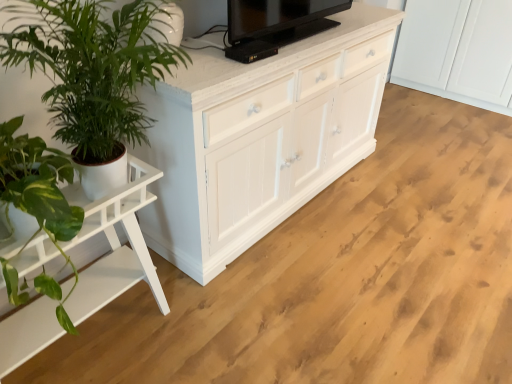
What is the approximate height of green leafy plant at left?

The height of green leafy plant at left is 25.84 inches.

The height and width of the screenshot is (384, 512). Identify the location of white wood table at left. (114, 244).

Where is `green leafy plant at left`? green leafy plant at left is located at coordinates (92, 76).

Does white wood table at left have a larger size compared to black glossy tv at upper center?

Correct, white wood table at left is larger in size than black glossy tv at upper center.

Considering the relative positions of white wood table at left and black glossy tv at upper center in the image provided, is white wood table at left in front of black glossy tv at upper center?

Yes, white wood table at left is in front of black glossy tv at upper center.

From the image's perspective, does white wood table at left appear higher than black glossy tv at upper center?

Incorrect, from the image's perspective, white wood table at left is lower than black glossy tv at upper center.

Considering the relative positions of white wood table at left and black glossy tv at upper center in the image provided, is white wood table at left to the left of black glossy tv at upper center from the viewer's perspective?

Correct, you'll find white wood table at left to the left of black glossy tv at upper center.

Is white wood table at left wider or thinner than green leafy plant at left?

Considering their sizes, white wood table at left looks slimmer than green leafy plant at left.

Looking at this image, is white wood table at left looking in the opposite direction of green leafy plant at left?

No, white wood table at left's orientation is not away from green leafy plant at left.

Which is closer, (x=44, y=340) or (x=89, y=155)?

Point (x=44, y=340) is farther from the camera than point (x=89, y=155).

The image size is (512, 384). In order to click on table behind the green leafy plant at left in this screenshot , I will do `click(114, 244)`.

Which is behind, black glossy tv at upper center or green leafy plant at left?

black glossy tv at upper center is more distant.

Does black glossy tv at upper center have a lesser width compared to green leafy plant at left?

Correct, the width of black glossy tv at upper center is less than that of green leafy plant at left.

Which object is positioned more to the left, black glossy tv at upper center or green leafy plant at left?

Positioned to the left is green leafy plant at left.

How distant is green leafy plant at left from black glossy tv at upper center?

They are 74.00 centimeters apart.

Considering the relative positions of green leafy plant at left and black glossy tv at upper center in the image provided, is green leafy plant at left to the left of black glossy tv at upper center from the viewer's perspective?

Yes.

Is green leafy plant at left positioned far away from black glossy tv at upper center?

green leafy plant at left is actually quite close to black glossy tv at upper center.

Looking at their sizes, would you say black glossy tv at upper center is wider or thinner than white wood table at left?

Clearly, black glossy tv at upper center has less width compared to white wood table at left.

Does point (327, 1) lie in front of point (125, 209)?

No, (327, 1) is behind (125, 209).

Which of these two, black glossy tv at upper center or white wood table at left, stands shorter?

With less height is black glossy tv at upper center.

Is green leafy plant at left directly adjacent to white wood table at left?

No, green leafy plant at left is not with white wood table at left.

Who is taller, green leafy plant at left or white wood table at left?

white wood table at left is taller.

How much distance is there between green leafy plant at left and white wood table at left?

green leafy plant at left and white wood table at left are 13.69 inches apart from each other.

Does green leafy plant at left lie in front of white wood table at left?

Answer: Yes, the depth of green leafy plant at left is less than that of white wood table at left.

Identify the location of television located above the white wood table at left (from a real-world perspective). (280, 19).

Find the location of a particular element. houseplant on the right of white wood table at left is located at coordinates (92, 76).

Which object lies further to the anchor point green leafy plant at left, white wood table at left or black glossy tv at upper center?

black glossy tv at upper center lies further to green leafy plant at left than the other object.

From the image, which object appears to be nearer to black glossy tv at upper center, green leafy plant at left or white wood table at left?

Based on the image, green leafy plant at left appears to be nearer to black glossy tv at upper center.

Which object lies nearer to the anchor point black glossy tv at upper center, white wood table at left or green leafy plant at left?

The object closer to black glossy tv at upper center is green leafy plant at left.

From the image, which object appears to be nearer to green leafy plant at left, black glossy tv at upper center or white wood table at left?

white wood table at left.

When comparing their distances from white wood table at left, does black glossy tv at upper center or green leafy plant at left seem closer?

Based on the image, green leafy plant at left appears to be nearer to white wood table at left.

Which object lies nearer to the anchor point white wood table at left, green leafy plant at left or black glossy tv at upper center?

green leafy plant at left.

This screenshot has width=512, height=384. I want to click on houseplant between black glossy tv at upper center and white wood table at left vertically, so click(x=92, y=76).